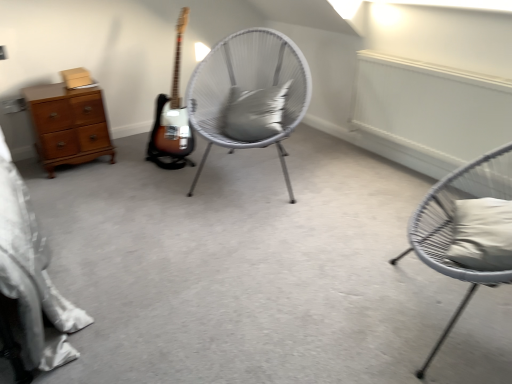
Locate an element on the screen. matte gray chair at right, placed as the first chair when sorted from right to left is located at coordinates (454, 226).

Describe the element at coordinates (248, 90) in the screenshot. This screenshot has height=384, width=512. I see `white wicker chair at center, which ranks as the first chair in left-to-right order` at that location.

What is the approximate width of wooden chest of drawers at left?

wooden chest of drawers at left is 45.56 centimeters wide.

Where is `matte gray chair at right, placed as the first chair when sorted from right to left`? matte gray chair at right, placed as the first chair when sorted from right to left is located at coordinates (454, 226).

Can you confirm if white wicker chair at center, which ranks as the first chair in left-to-right order, is thinner than white fabric pillow at right, the 1th pillow in the front-to-back sequence?

Result: No, white wicker chair at center, which ranks as the first chair in left-to-right order, is not thinner than white fabric pillow at right, the 1th pillow in the front-to-back sequence.

From the image's perspective, is white wicker chair at center, which ranks as the first chair in left-to-right order, located above white fabric pillow at right, the 1th pillow in the front-to-back sequence?

Yes, from the image's perspective, white wicker chair at center, which ranks as the first chair in left-to-right order, is over white fabric pillow at right, the 1th pillow in the front-to-back sequence.

Find the location of `chair above the white fabric pillow at right, the second pillow viewed from the left (from the image's perspective)`. chair above the white fabric pillow at right, the second pillow viewed from the left (from the image's perspective) is located at coordinates (248, 90).

Relative to white fabric pillow at right, the 1th pillow in the front-to-back sequence, is white wicker chair at center, positioned as the 2th chair in front-to-back order, in front or behind?

white wicker chair at center, positioned as the 2th chair in front-to-back order, is behind white fabric pillow at right, the 1th pillow in the front-to-back sequence.

From the image's perspective, which is above, white fabric pillow at right, the second pillow viewed from the top, or white wicker chair at center, which is the 1th chair from back to front?

white wicker chair at center, which is the 1th chair from back to front.

Which of these two, white fabric pillow at right, the 1th pillow in the front-to-back sequence, or white wicker chair at center, which ranks as the first chair in left-to-right order, is wider?

white wicker chair at center, which ranks as the first chair in left-to-right order, is wider.

From a real-world perspective, relative to white wicker chair at center, which is the 1th chair from back to front, is white fabric pillow at right, which ranks as the 1th pillow in right-to-left order, vertically above or below?

white fabric pillow at right, which ranks as the 1th pillow in right-to-left order, is situated higher than white wicker chair at center, which is the 1th chair from back to front, in the real world.

Which is more distant, (492, 247) or (268, 141)?

The point (268, 141) is behind.

Are matte gray chair at right, the 1th chair viewed from the front, and gray matte pillow at center, which is counted as the second pillow, starting from the bottom, far apart?

Yes, matte gray chair at right, the 1th chair viewed from the front, is far from gray matte pillow at center, which is counted as the second pillow, starting from the bottom.

Measure the distance between matte gray chair at right, the 1th chair viewed from the front, and gray matte pillow at center, the second pillow viewed from the front.

A distance of 1.10 meters exists between matte gray chair at right, the 1th chair viewed from the front, and gray matte pillow at center, the second pillow viewed from the front.

Looking at this image, from the image's perspective, which object appears higher, matte gray chair at right, which is the 2th chair in left-to-right order, or gray matte pillow at center, which is counted as the 1th pillow, starting from the top?

gray matte pillow at center, which is counted as the 1th pillow, starting from the top, from the image's perspective.

In the image, is matte gray chair at right, placed as the first chair when sorted from right to left, positioned in front of or behind gray matte pillow at center, the second pillow viewed from the front?

matte gray chair at right, placed as the first chair when sorted from right to left, is positioned closer to the viewer than gray matte pillow at center, the second pillow viewed from the front.

Who is taller, white fabric pillow at right, which ranks as the 1th pillow in right-to-left order, or gray matte pillow at center, positioned as the second pillow in right-to-left order?

gray matte pillow at center, positioned as the second pillow in right-to-left order.

From a real-world perspective, which object rests below the other?

From a 3D spatial view, white fabric pillow at right, the 2th pillow positioned from the back, is below.

Looking at this image, is white fabric pillow at right, the first pillow in the bottom-to-top sequence, oriented away from gray matte pillow at center, which is counted as the second pillow, starting from the bottom?

white fabric pillow at right, the first pillow in the bottom-to-top sequence, does not have its back to gray matte pillow at center, which is counted as the second pillow, starting from the bottom.

Is wooden chest of drawers at left inside white fabric pillow at right, the 2th pillow positioned from the back?

Actually, wooden chest of drawers at left is outside white fabric pillow at right, the 2th pillow positioned from the back.

In terms of height, does white fabric pillow at right, the second pillow viewed from the left, look taller or shorter compared to wooden chest of drawers at left?

Clearly, white fabric pillow at right, the second pillow viewed from the left, is shorter compared to wooden chest of drawers at left.

Looking at this image, considering the relative sizes of white fabric pillow at right, the first pillow in the bottom-to-top sequence, and wooden chest of drawers at left in the image provided, is white fabric pillow at right, the first pillow in the bottom-to-top sequence, thinner than wooden chest of drawers at left?

Correct, the width of white fabric pillow at right, the first pillow in the bottom-to-top sequence, is less than that of wooden chest of drawers at left.

Is white wicker chair at center, positioned as the 2th chair in front-to-back order, thinner than gray matte pillow at center, arranged as the 1th pillow when viewed from the back?

In fact, white wicker chair at center, positioned as the 2th chair in front-to-back order, might be wider than gray matte pillow at center, arranged as the 1th pillow when viewed from the back.

In the scene shown: Is white wicker chair at center, which ranks as the first chair in left-to-right order, located outside gray matte pillow at center, which is counted as the 1th pillow, starting from the top?

Yes, white wicker chair at center, which ranks as the first chair in left-to-right order, is outside of gray matte pillow at center, which is counted as the 1th pillow, starting from the top.

Considering the sizes of objects white wicker chair at center, the second chair from the right, and gray matte pillow at center, arranged as the 1th pillow when viewed from the back, in the image provided, who is taller, white wicker chair at center, the second chair from the right, or gray matte pillow at center, arranged as the 1th pillow when viewed from the back,?

With more height is white wicker chair at center, the second chair from the right.

Is white wicker chair at center, which is the 1th chair from back to front, at the left side of gray matte pillow at center, which is counted as the second pillow, starting from the bottom?

Correct, you'll find white wicker chair at center, which is the 1th chair from back to front, to the left of gray matte pillow at center, which is counted as the second pillow, starting from the bottom.

Can you confirm if white fabric pillow at right, the 2th pillow positioned from the back, is bigger than matte gray chair at right, placed as the first chair when sorted from right to left?

No, white fabric pillow at right, the 2th pillow positioned from the back, is not bigger than matte gray chair at right, placed as the first chair when sorted from right to left.

Can you confirm if white fabric pillow at right, the 2th pillow positioned from the back, is thinner than matte gray chair at right, which is the 2th chair in left-to-right order?

Correct, the width of white fabric pillow at right, the 2th pillow positioned from the back, is less than that of matte gray chair at right, which is the 2th chair in left-to-right order.

Does white fabric pillow at right, the second pillow viewed from the left, turn towards matte gray chair at right, placed as the first chair when sorted from right to left?

Yes, white fabric pillow at right, the second pillow viewed from the left, is facing matte gray chair at right, placed as the first chair when sorted from right to left.

You are a GUI agent. You are given a task and a screenshot of the screen. Output one action in this format:
    pyautogui.click(x=<x>, y=<y>)
    Task: Click on the pillow that is the 2nd one when counting rightward from the white wicker chair at center, which is the 1th chair from back to front
    Image resolution: width=512 pixels, height=384 pixels.
    Given the screenshot: What is the action you would take?
    pyautogui.click(x=482, y=234)

The height and width of the screenshot is (384, 512). In order to click on chair above the white fabric pillow at right, the first pillow in the bottom-to-top sequence (from the image's perspective) in this screenshot , I will do `click(248, 90)`.

Estimate the real-world distances between objects in this image. Which object is closer to white fabric pillow at right, the second pillow viewed from the left, gray matte pillow at center, positioned as the second pillow in right-to-left order, or white wicker chair at center, which ranks as the first chair in left-to-right order?

Based on the image, gray matte pillow at center, positioned as the second pillow in right-to-left order, appears to be nearer to white fabric pillow at right, the second pillow viewed from the left.

From the image, which object appears to be farther from matte gray chair at right, placed as the first chair when sorted from right to left, white wicker chair at center, positioned as the 2th chair in front-to-back order, or white fabric pillow at right, the 2th pillow positioned from the back?

white wicker chair at center, positioned as the 2th chair in front-to-back order, lies further to matte gray chair at right, placed as the first chair when sorted from right to left, than the other object.

Looking at the image, which one is located closer to wooden chest of drawers at left, gray matte pillow at center, which is counted as the 1th pillow, starting from the top, or white wicker chair at center, which ranks as the first chair in left-to-right order?

white wicker chair at center, which ranks as the first chair in left-to-right order, is closer to wooden chest of drawers at left.

Which object lies further to the anchor point white fabric pillow at right, the first pillow in the bottom-to-top sequence, white wicker chair at center, which ranks as the first chair in left-to-right order, or matte gray chair at right, the 1th chair viewed from the front?

white wicker chair at center, which ranks as the first chair in left-to-right order, is further to white fabric pillow at right, the first pillow in the bottom-to-top sequence.

Based on their spatial positions, is gray matte pillow at center, the second pillow viewed from the front, or matte gray chair at right, which is the 2th chair in left-to-right order, further from white fabric pillow at right, the second pillow viewed from the left?

Based on the image, gray matte pillow at center, the second pillow viewed from the front, appears to be further to white fabric pillow at right, the second pillow viewed from the left.

Based on their spatial positions, is wooden chest of drawers at left or matte gray chair at right, the 1th chair viewed from the front, closer to white wicker chair at center, which is the 1th chair from back to front?

The object closer to white wicker chair at center, which is the 1th chair from back to front, is wooden chest of drawers at left.

When comparing their distances from matte gray chair at right, the 1th chair viewed from the front, does wooden chest of drawers at left or white wicker chair at center, which ranks as the first chair in left-to-right order, seem further?

wooden chest of drawers at left is further to matte gray chair at right, the 1th chair viewed from the front.

Considering their positions, is white fabric pillow at right, the first pillow in the bottom-to-top sequence, positioned closer to white wicker chair at center, the second chair from the right, than wooden chest of drawers at left?

Based on the image, wooden chest of drawers at left appears to be nearer to white wicker chair at center, the second chair from the right.

Find the location of a particular element. The image size is (512, 384). chair between white fabric pillow at right, the second pillow viewed from the top, and gray matte pillow at center, positioned as the second pillow in right-to-left order, along the z-axis is located at coordinates (248, 90).

Locate an element on the screen. The image size is (512, 384). pillow between matte gray chair at right, the 1th chair viewed from the front, and white wicker chair at center, which ranks as the first chair in left-to-right order, in the front-back direction is located at coordinates (482, 234).

Locate an element on the screen. chair situated between wooden chest of drawers at left and gray matte pillow at center, which is counted as the second pillow, starting from the bottom, from left to right is located at coordinates [x=248, y=90].

At what (x,y) coordinates should I click in order to perform the action: click on chair between wooden chest of drawers at left and white fabric pillow at right, the second pillow viewed from the top. Please return your answer as a coordinate pair (x, y). The image size is (512, 384). Looking at the image, I should click on pyautogui.click(x=248, y=90).